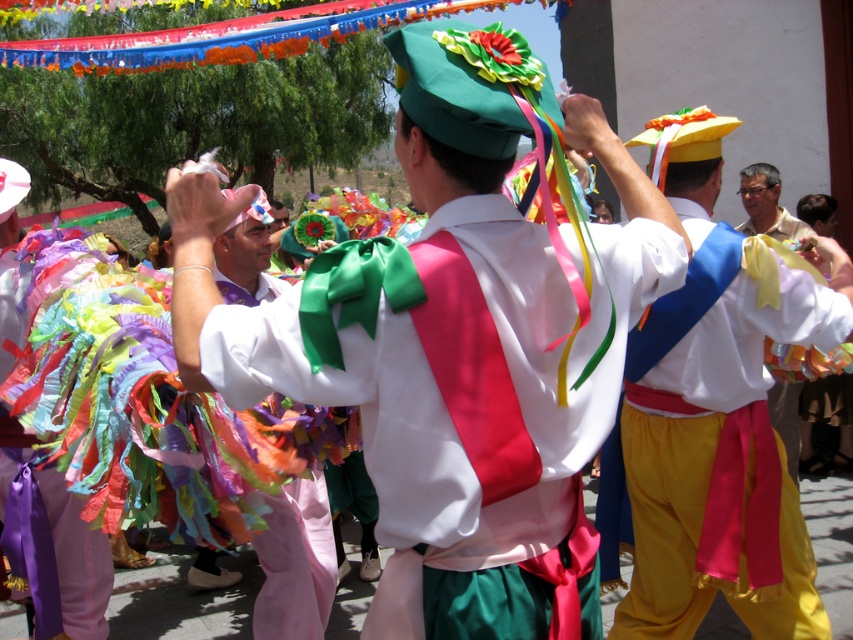
Does point (77, 257) lie behind point (189, 268)?

That is True.

Can you confirm if multicolored fabric ribbons at center is smaller than matte pink pants at center?

No, multicolored fabric ribbons at center is not smaller than matte pink pants at center.

Is point (120, 417) farther from viewer compared to point (206, 384)?

That is True.

Locate an element on the screen. This screenshot has height=640, width=853. multicolored fabric ribbons at center is located at coordinates (164, 420).

Is silky white blouse at center to the left of matte pink pants at center from the viewer's perspective?

Incorrect, silky white blouse at center is not on the left side of matte pink pants at center.

Between silky white blouse at center and matte pink pants at center, which one is positioned higher?

Positioned higher is silky white blouse at center.

Image resolution: width=853 pixels, height=640 pixels. I want to click on silky white blouse at center, so click(281, 355).

Is silky white blouse at center smaller than multicolored ribbons at center?

Actually, silky white blouse at center might be larger than multicolored ribbons at center.

Does point (201, 337) come closer to viewer compared to point (25, 284)?

Yes, it is in front of point (25, 284).

Measure the distance between point (544, 333) and camera.

6.61 feet

Identify the location of silky white blouse at center. Image resolution: width=853 pixels, height=640 pixels. (281, 355).